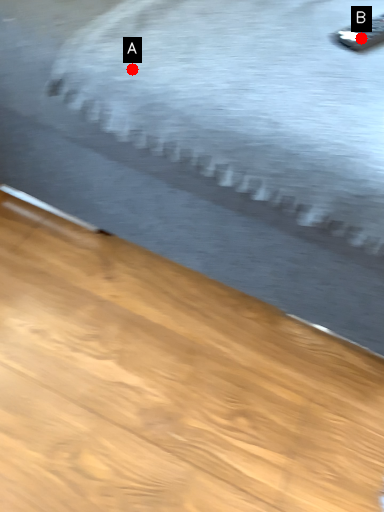
Question: Two points are circled on the image, labeled by A and B beside each circle. Which of the following is the closest to the observer?

Choices:
 (A) A is closer
 (B) B is closer

Answer: (A)